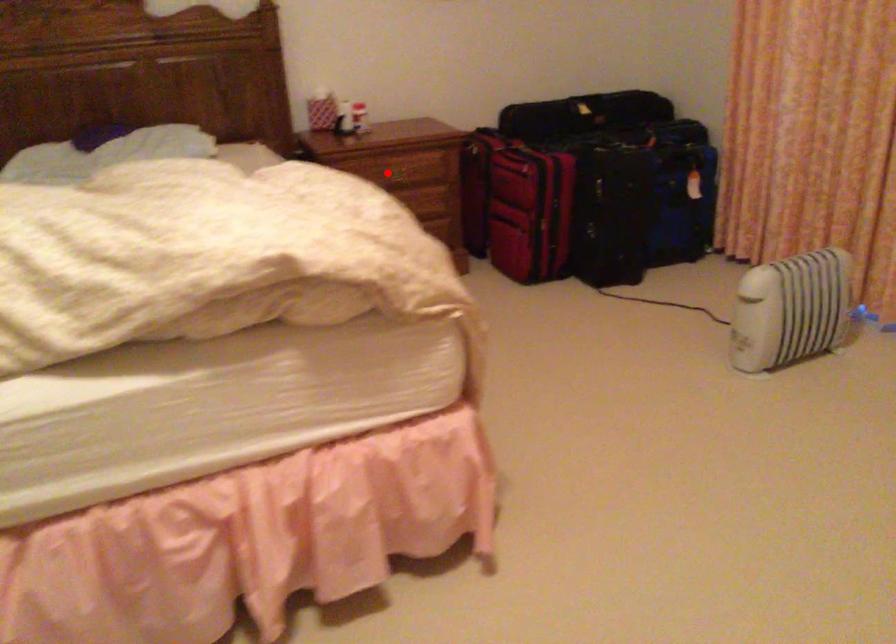
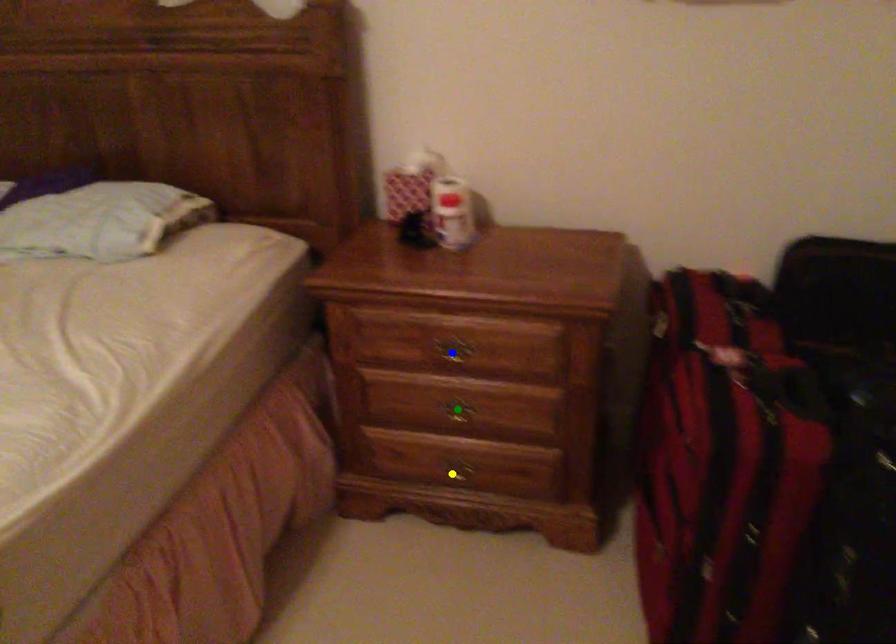
Question: I am providing you with two images of the same scene from different viewpoints. A red point is marked on the first image. You are given multiple points on the second image. Can you choose the point in image 2 that corresponds to the point in image 1?

Choices:
 (A) yellow point
 (B) green point
 (C) blue point

Answer: (C)